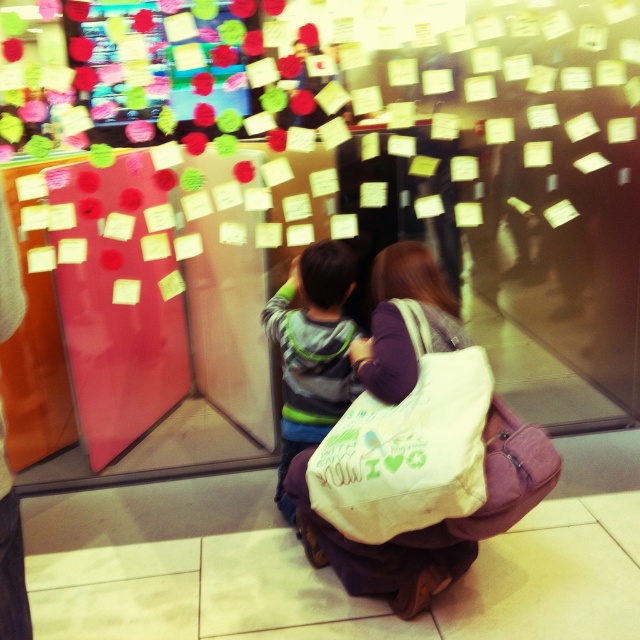
Is white canvas tote at center to the right of striped sweater at center from the viewer's perspective?

Yes, white canvas tote at center is to the right of striped sweater at center.

Does point (412, 433) come in front of point (305, 428)?

Yes, it is.

This screenshot has height=640, width=640. Identify the location of white canvas tote at center. (406, 444).